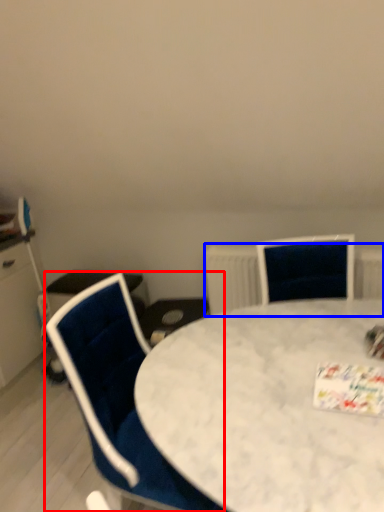
Question: Which of the following is the closest to the observer, chair (highlighted by a red box) or radiator (highlighted by a blue box)?

Choices:
 (A) chair
 (B) radiator

Answer: (A)